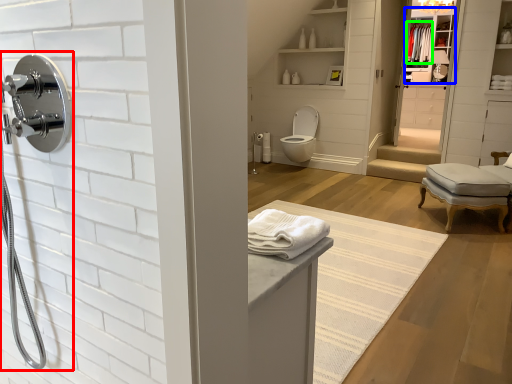
Question: Which object is positioned closest to shower (highlighted by a red box)? Select from medicine cabinet (highlighted by a blue box) and bath towel (highlighted by a green box).

Choices:
 (A) medicine cabinet
 (B) bath towel

Answer: (A)